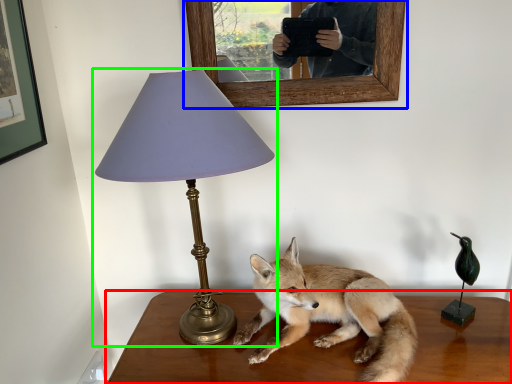
Question: Considering the real-world distances, which object is closest to table (highlighted by a red box)? picture frame (highlighted by a blue box) or lamp (highlighted by a green box).

Choices:
 (A) picture frame
 (B) lamp

Answer: (B)